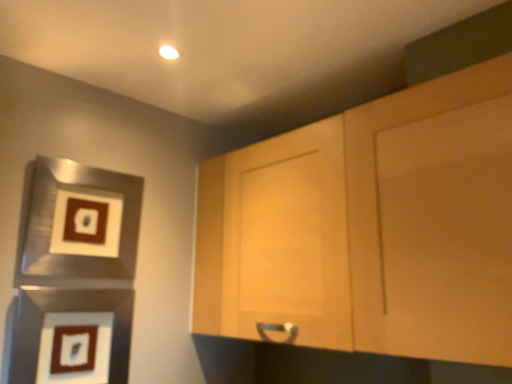
Question: Is matte black picture frame at lower left, positioned as the second picture frame in top-to-bottom order, touching brushed metal picture frame at left, which appears as the 1th picture frame when viewed from the top?

Choices:
 (A) yes
 (B) no

Answer: (B)

Question: From a real-world perspective, is matte black picture frame at lower left, positioned as the second picture frame in top-to-bottom order, located higher than brushed metal picture frame at left, which appears as the 1th picture frame when viewed from the top?

Choices:
 (A) no
 (B) yes

Answer: (A)

Question: Is matte black picture frame at lower left, the 1th picture frame when ordered from bottom to top, positioned beyond the bounds of brushed metal picture frame at left, the 2th picture frame when ordered from bottom to top?

Choices:
 (A) no
 (B) yes

Answer: (B)

Question: From a real-world perspective, is matte black picture frame at lower left, positioned as the second picture frame in top-to-bottom order, physically below brushed metal picture frame at left, the 2th picture frame when ordered from bottom to top?

Choices:
 (A) no
 (B) yes

Answer: (B)

Question: From the image's perspective, is matte black picture frame at lower left, positioned as the second picture frame in top-to-bottom order, located beneath brushed metal picture frame at left, which appears as the 1th picture frame when viewed from the top?

Choices:
 (A) no
 (B) yes

Answer: (B)

Question: Is matte black picture frame at lower left, positioned as the second picture frame in top-to-bottom order, facing towards brushed metal picture frame at left, the 2th picture frame when ordered from bottom to top?

Choices:
 (A) yes
 (B) no

Answer: (B)

Question: Considering the relative sizes of light wood cabinet at upper right and matte black picture frame at lower left, the 1th picture frame when ordered from bottom to top, in the image provided, is light wood cabinet at upper right smaller than matte black picture frame at lower left, the 1th picture frame when ordered from bottom to top,?

Choices:
 (A) yes
 (B) no

Answer: (B)

Question: Can you confirm if light wood cabinet at upper right is shorter than matte black picture frame at lower left, the 1th picture frame when ordered from bottom to top?

Choices:
 (A) yes
 (B) no

Answer: (B)

Question: Is light wood cabinet at upper right closer to the viewer compared to matte black picture frame at lower left, the 1th picture frame when ordered from bottom to top?

Choices:
 (A) no
 (B) yes

Answer: (B)

Question: Would you say light wood cabinet at upper right is a long distance from matte black picture frame at lower left, positioned as the second picture frame in top-to-bottom order?

Choices:
 (A) no
 (B) yes

Answer: (A)

Question: From the image's perspective, is light wood cabinet at upper right under matte black picture frame at lower left, positioned as the second picture frame in top-to-bottom order?

Choices:
 (A) no
 (B) yes

Answer: (A)

Question: From the image's perspective, would you say light wood cabinet at upper right is positioned over matte black picture frame at lower left, the 1th picture frame when ordered from bottom to top?

Choices:
 (A) no
 (B) yes

Answer: (B)

Question: Is matte black picture frame at lower left, the 1th picture frame when ordered from bottom to top, turned away from light wood cabinet at upper right?

Choices:
 (A) no
 (B) yes

Answer: (A)